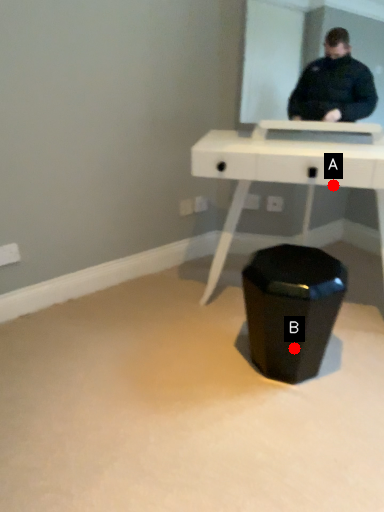
Question: Two points are circled on the image, labeled by A and B beside each circle. Which point is farther from the camera taking this photo?

Choices:
 (A) A is further
 (B) B is further

Answer: (A)